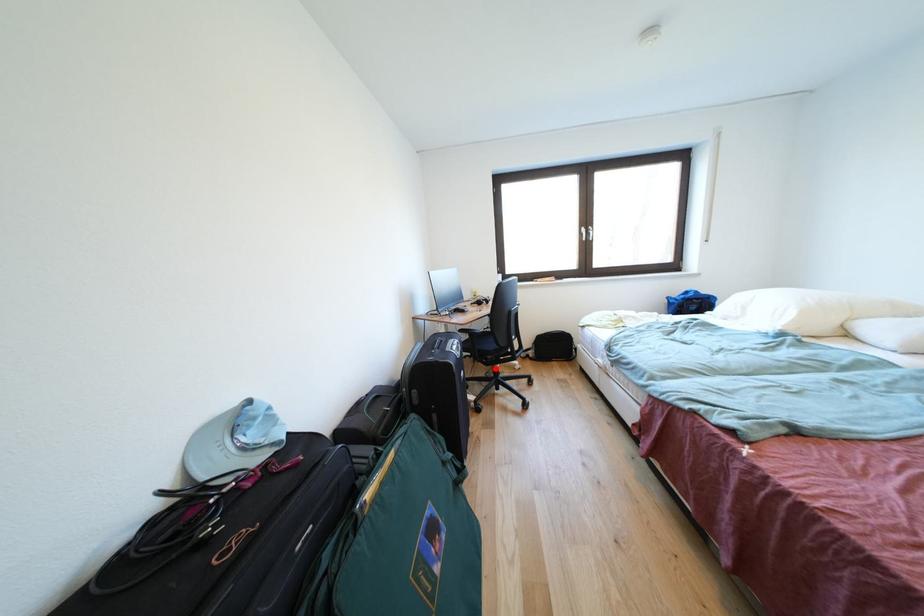
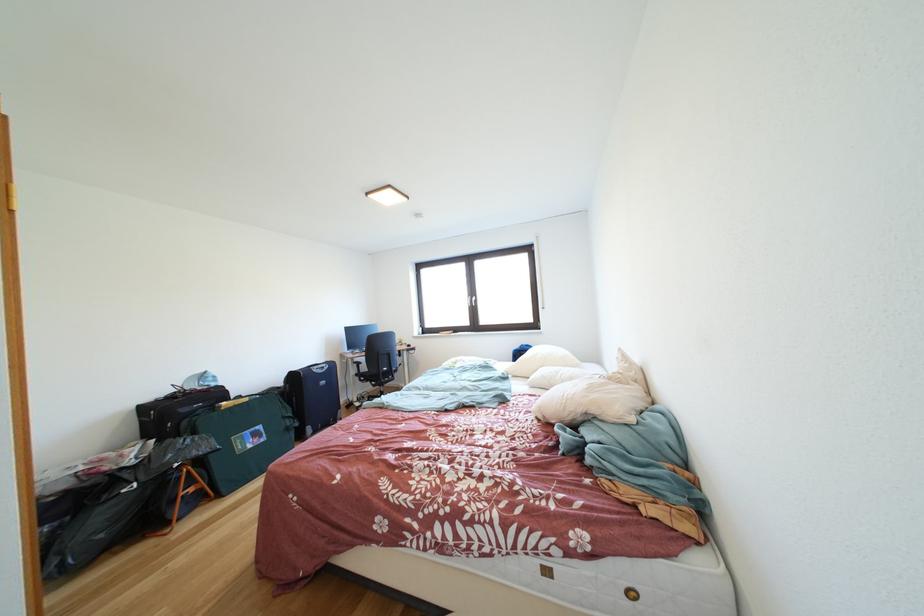
Question: I am providing you with two images of the same scene from different viewpoints. Given a red point in image1, look at the same physical point in image2. Is it:

Choices:
 (A) Closer to the viewpoint
 (B) Farther from the viewpoint

Answer: (B)